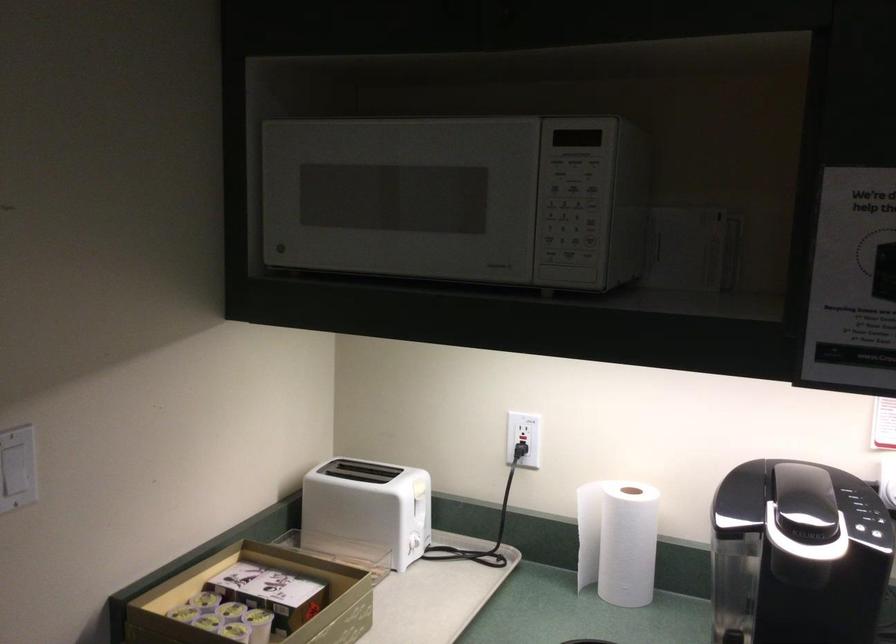
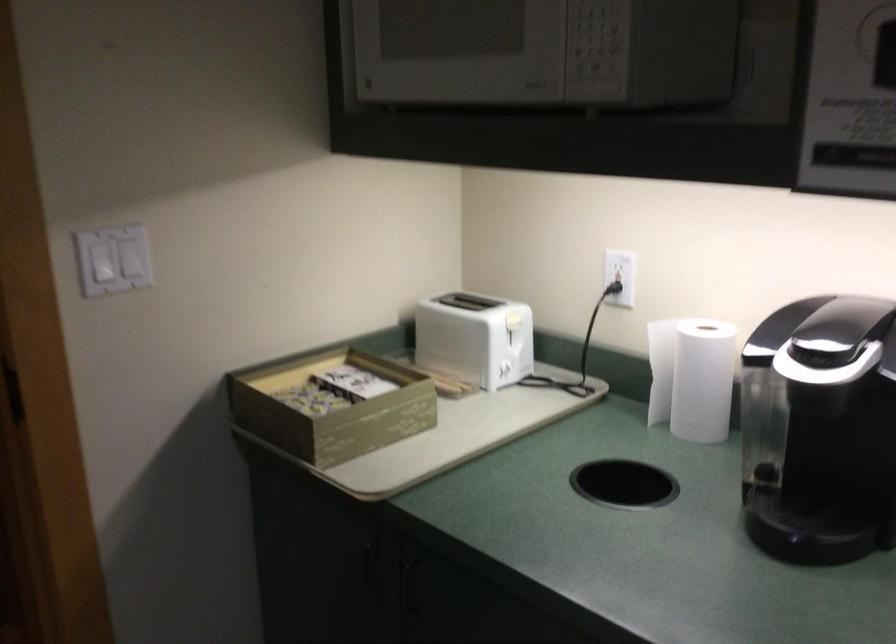
The point at (636,544) is marked in the first image. Where is the corresponding point in the second image?

(702, 380)